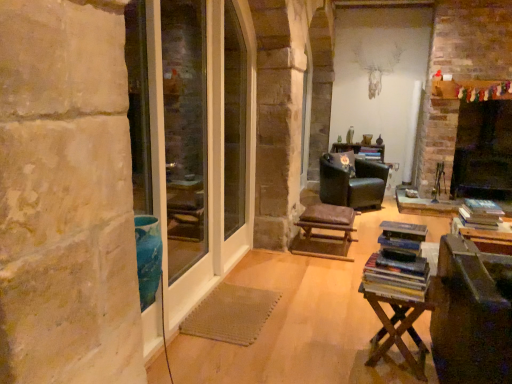
You are a GUI agent. You are given a task and a screenshot of the screen. Output one action in this format:
    pyautogui.click(x=<x>, y=<y>)
    Task: Click on the free spot in front of clear glass door at left, the first screen door viewed from the left
    
    Given the screenshot: What is the action you would take?
    pyautogui.click(x=208, y=345)